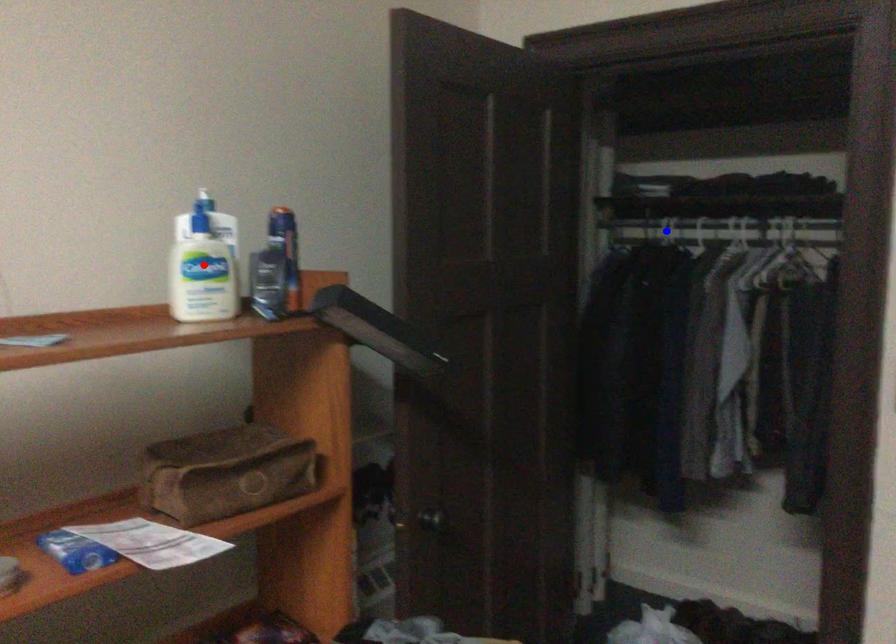
Question: Which of the two points in the image is closer to the camera?

Choices:
 (A) Blue point is closer.
 (B) Red point is closer.

Answer: (B)